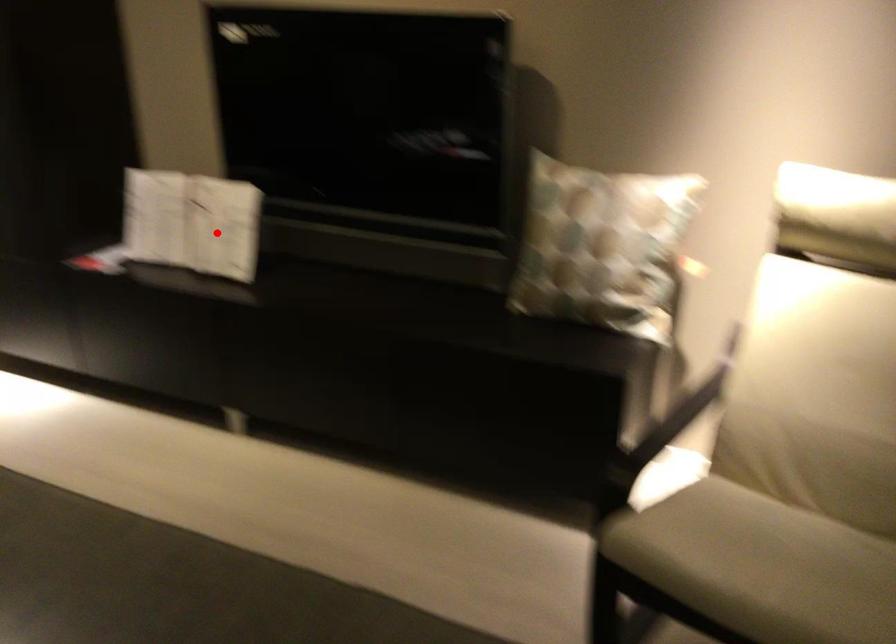
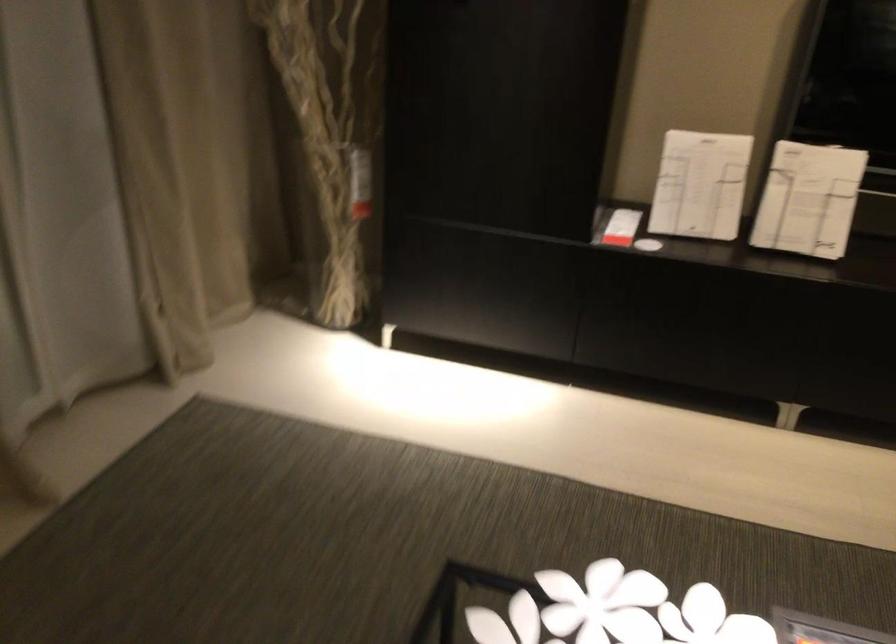
In the second image, find the point that corresponds to the highlighted location in the first image.

(808, 200)